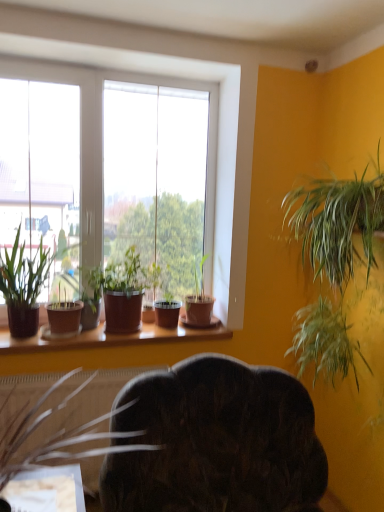
Find the location of a particular element. matte brown pot at window, which appears as the second houseplant when viewed from the right is located at coordinates (199, 298).

Where is `matte brown pot at window, arranged as the 1th houseplant when viewed from the left`? The width and height of the screenshot is (384, 512). matte brown pot at window, arranged as the 1th houseplant when viewed from the left is located at coordinates (91, 296).

What is the approximate width of brown matte pot at lower left, marked as the fifth houseplant in a right-to-left arrangement?

brown matte pot at lower left, marked as the fifth houseplant in a right-to-left arrangement, is 26.07 inches wide.

Locate an element on the screen. The height and width of the screenshot is (512, 384). dark wood swivel chair at center is located at coordinates (215, 442).

This screenshot has width=384, height=512. I want to click on matte brown pot at window, the 3th houseplant from the left, so click(122, 292).

From the image's perspective, does matte brown pot at window, the sixth houseplant viewed from the right, appear higher than brown matte pot at lower left, marked as the fifth houseplant in a right-to-left arrangement?

Indeed, from the image's perspective, matte brown pot at window, the sixth houseplant viewed from the right, is shown above brown matte pot at lower left, marked as the fifth houseplant in a right-to-left arrangement.

I want to click on houseplant that is on the left side of brown matte pot at lower left, positioned as the second houseplant in left-to-right order, so click(91, 296).

Can you tell me how much matte brown pot at window, arranged as the 1th houseplant when viewed from the left, and brown matte pot at lower left, marked as the fifth houseplant in a right-to-left arrangement, differ in facing direction?

The facing directions of matte brown pot at window, arranged as the 1th houseplant when viewed from the left, and brown matte pot at lower left, marked as the fifth houseplant in a right-to-left arrangement, are 4.54 degrees apart.

From a real-world perspective, is matte brown pot at window, the sixth houseplant viewed from the right, positioned under brown matte pot at lower left, positioned as the second houseplant in left-to-right order, based on gravity?

Actually, matte brown pot at window, the sixth houseplant viewed from the right, is physically above brown matte pot at lower left, positioned as the second houseplant in left-to-right order, in the real world.

Which object is closer to the camera, green leafy plant at right, which appears as the 6th houseplant when viewed from the left, or white plastic window at left?

green leafy plant at right, which appears as the 6th houseplant when viewed from the left, is closer to the camera.

Can you confirm if green leafy plant at right, the first houseplant from the right, is thinner than white plastic window at left?

Incorrect, the width of green leafy plant at right, the first houseplant from the right, is not less than that of white plastic window at left.

Is white plastic window at left at the back of green leafy plant at right, the first houseplant from the right?

No.

Between green leafy plant at right, the first houseplant from the right, and white plastic window at left, which one has more height?

white plastic window at left is taller.

Considering the relative sizes of matte brown pot at window, the sixth houseplant viewed from the right, and dark wood swivel chair at center in the image provided, is matte brown pot at window, the sixth houseplant viewed from the right, smaller than dark wood swivel chair at center?

Yes.

In the scene shown: Is matte brown pot at window, arranged as the 1th houseplant when viewed from the left, located outside dark wood swivel chair at center?

Yes, matte brown pot at window, arranged as the 1th houseplant when viewed from the left, is not within dark wood swivel chair at center.

Is matte brown pot at window, the sixth houseplant viewed from the right, wider or thinner than dark wood swivel chair at center?

Clearly, matte brown pot at window, the sixth houseplant viewed from the right, has less width compared to dark wood swivel chair at center.

Could you measure the distance between matte brown pot at window, arranged as the 1th houseplant when viewed from the left, and dark wood swivel chair at center?

They are 3.29 feet apart.

Does green leafy plant at right, the first houseplant from the right, have a larger size compared to green matte plant at center, arranged as the third houseplant when viewed from the right?

Yes.

Identify the location of houseplant that is the 4th object located above the green matte plant at center, the 4th houseplant in the left-to-right sequence (from the image's perspective). The image size is (384, 512). 334,263.

Looking at this image, which of these two, green leafy plant at right, which appears as the 6th houseplant when viewed from the left, or green matte plant at center, arranged as the third houseplant when viewed from the right, stands shorter?

With less height is green matte plant at center, arranged as the third houseplant when viewed from the right.

Measure the distance between green leafy plant at right, the first houseplant from the right, and green matte plant at center, the 4th houseplant in the left-to-right sequence.

91.49 centimeters.

Identify the location of the 3rd houseplant located above the brown matte pot at lower left, positioned as the second houseplant in left-to-right order (from a real-world perspective). Image resolution: width=384 pixels, height=512 pixels. (91, 296).

Is brown matte pot at lower left, positioned as the second houseplant in left-to-right order, positioned with its back to matte brown pot at window, arranged as the 1th houseplant when viewed from the left?

Yes.

Between brown matte pot at lower left, marked as the fifth houseplant in a right-to-left arrangement, and matte brown pot at window, arranged as the 1th houseplant when viewed from the left, which one appears on the left side from the viewer's perspective?

From the viewer's perspective, matte brown pot at window, arranged as the 1th houseplant when viewed from the left, appears more on the left side.

In terms of height, does brown matte pot at lower left, marked as the fifth houseplant in a right-to-left arrangement, look taller or shorter compared to matte brown pot at window, arranged as the 1th houseplant when viewed from the left?

Clearly, brown matte pot at lower left, marked as the fifth houseplant in a right-to-left arrangement, is taller compared to matte brown pot at window, arranged as the 1th houseplant when viewed from the left.

Image resolution: width=384 pixels, height=512 pixels. I want to click on swivel chair below the matte brown pot at window, the fourth houseplant positioned from the right (from the image's perspective), so click(x=215, y=442).

Which is in front, dark wood swivel chair at center or matte brown pot at window, the fourth houseplant positioned from the right?

dark wood swivel chair at center.

In terms of width, does dark wood swivel chair at center look wider or thinner when compared to matte brown pot at window, the fourth houseplant positioned from the right?

Clearly, dark wood swivel chair at center has more width compared to matte brown pot at window, the fourth houseplant positioned from the right.

Is dark wood swivel chair at center not close to matte brown pot at window, the 3th houseplant from the left?

No.

Is brown ceramic pots at lower center facing towards dark wood swivel chair at center?

Yes, brown ceramic pots at lower center is oriented towards dark wood swivel chair at center.

At what (x,y) coordinates should I click in order to perform the action: click on swivel chair located on the right of brown ceramic pots at lower center. Please return your answer as a coordinate pair (x, y). Looking at the image, I should click on (215, 442).

Does brown ceramic pots at lower center have a lesser height compared to dark wood swivel chair at center?

Yes, brown ceramic pots at lower center is shorter than dark wood swivel chair at center.

From a real-world perspective, who is located lower, brown ceramic pots at lower center or dark wood swivel chair at center?

In real-world perspective, dark wood swivel chair at center is lower.

There is a matte brown pot at window, the sixth houseplant viewed from the right. Identify the location of the 3rd houseplant below it (from a real-world perspective). This screenshot has width=384, height=512. (57, 407).

Locate an element on the screen. This screenshot has width=384, height=512. window above the green leafy plant at right, which appears as the 6th houseplant when viewed from the left (from a real-world perspective) is located at coordinates (102, 143).

Considering their positions, is green matte plant at center, arranged as the third houseplant when viewed from the right, positioned further to brown matte pot at lower left, marked as the fifth houseplant in a right-to-left arrangement, than matte brown pot at window, the fourth houseplant positioned from the right?

green matte plant at center, arranged as the third houseplant when viewed from the right, is positioned further to the anchor brown matte pot at lower left, marked as the fifth houseplant in a right-to-left arrangement.

Based on their spatial positions, is brown matte pot at lower left, positioned as the second houseplant in left-to-right order, or matte brown pot at window, the fourth houseplant positioned from the right, closer to green matte plant at center, the 4th houseplant in the left-to-right sequence?

The object closer to green matte plant at center, the 4th houseplant in the left-to-right sequence, is matte brown pot at window, the fourth houseplant positioned from the right.

Estimate the real-world distances between objects in this image. Which object is closer to brown matte pot at lower left, positioned as the second houseplant in left-to-right order, green matte plant at center, the 4th houseplant in the left-to-right sequence, or dark wood swivel chair at center?

green matte plant at center, the 4th houseplant in the left-to-right sequence, is closer to brown matte pot at lower left, positioned as the second houseplant in left-to-right order.

Estimate the real-world distances between objects in this image. Which object is closer to matte brown pot at window, the 3th houseplant from the left, matte brown pot at window, arranged as the 1th houseplant when viewed from the left, or green leafy plant at right, which appears as the 6th houseplant when viewed from the left?

Among the two, matte brown pot at window, arranged as the 1th houseplant when viewed from the left, is located nearer to matte brown pot at window, the 3th houseplant from the left.

Consider the image. Which object lies nearer to the anchor point brown matte pot at lower left, marked as the fifth houseplant in a right-to-left arrangement, matte brown pot at window, which is counted as the 5th houseplant, starting from the left, or brown ceramic pots at lower center?

Among the two, brown ceramic pots at lower center is located nearer to brown matte pot at lower left, marked as the fifth houseplant in a right-to-left arrangement.

Based on their spatial positions, is brown matte pot at lower left, marked as the fifth houseplant in a right-to-left arrangement, or dark wood swivel chair at center closer to brown ceramic pots at lower center?

brown matte pot at lower left, marked as the fifth houseplant in a right-to-left arrangement, is positioned closer to the anchor brown ceramic pots at lower center.

Estimate the real-world distances between objects in this image. Which object is further from matte brown pot at window, the sixth houseplant viewed from the right, green matte plant at center, arranged as the third houseplant when viewed from the right, or green leafy plant at right, which appears as the 6th houseplant when viewed from the left?

green leafy plant at right, which appears as the 6th houseplant when viewed from the left, lies further to matte brown pot at window, the sixth houseplant viewed from the right, than the other object.

Based on their spatial positions, is green leafy plant at right, the first houseplant from the right, or brown ceramic pots at lower center closer to matte brown pot at window, the 3th houseplant from the left?

brown ceramic pots at lower center.

The image size is (384, 512). In order to click on window sill between brown matte pot at lower left, positioned as the second houseplant in left-to-right order, and white plastic window at left, along the z-axis in this screenshot , I will do `click(112, 337)`.

The image size is (384, 512). I want to click on houseplant located between matte brown pot at window, the 3th houseplant from the left, and matte brown pot at window, which is counted as the 5th houseplant, starting from the left, in the left-right direction, so click(x=167, y=313).

This screenshot has width=384, height=512. Find the location of `window sill positioned between brown matte pot at lower left, positioned as the second houseplant in left-to-right order, and matte brown pot at window, which appears as the second houseplant when viewed from the right, from near to far`. window sill positioned between brown matte pot at lower left, positioned as the second houseplant in left-to-right order, and matte brown pot at window, which appears as the second houseplant when viewed from the right, from near to far is located at coordinates (112, 337).

Find the location of a particular element. This screenshot has height=512, width=384. houseplant between brown matte pot at lower left, marked as the fifth houseplant in a right-to-left arrangement, and brown ceramic pots at lower center, along the z-axis is located at coordinates (334, 263).